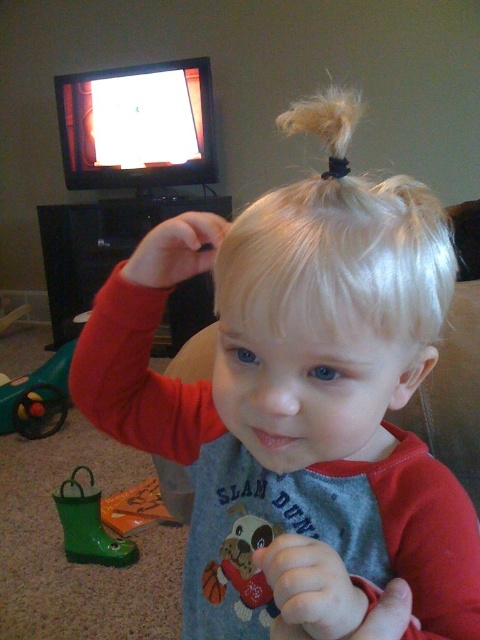
Question: Among these objects, which one is farthest from the camera?

Choices:
 (A) rubber green boot at lower left
 (B) soft plush dog at center
 (C) fuzzy blonde hair at top

Answer: (C)

Question: Is the position of blonde silky hair at center more distant than that of soft plush dog at center?

Choices:
 (A) no
 (B) yes

Answer: (A)

Question: Is the position of matte black hair at upper center less distant than that of fuzzy blonde hair at top?

Choices:
 (A) yes
 (B) no

Answer: (A)

Question: Which is nearer to the rubber green boot at lower left?

Choices:
 (A) blonde silky hair at center
 (B) fuzzy blonde hair at top
 (C) green rubber boot at lower left
 (D) green rubber toy at lower left

Answer: (C)

Question: Which point is farther from the camera taking this photo?

Choices:
 (A) (239, 522)
 (B) (170, 234)

Answer: (A)

Question: Does matte plastic hand at center appear on the right side of fuzzy blonde hair at top?

Choices:
 (A) no
 (B) yes

Answer: (A)